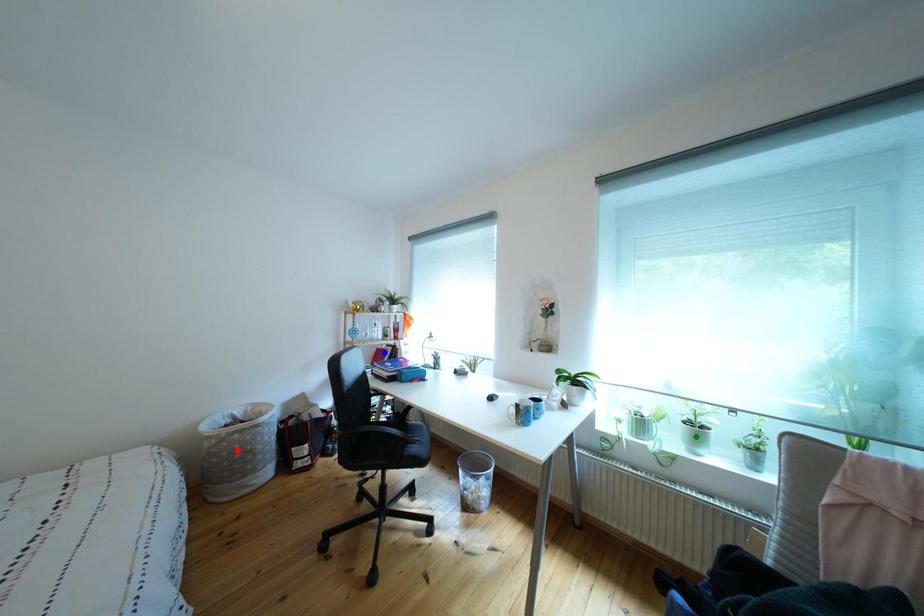
Order these from nearest to farthest:
A) green point
B) blue point
C) red point

1. green point
2. red point
3. blue point